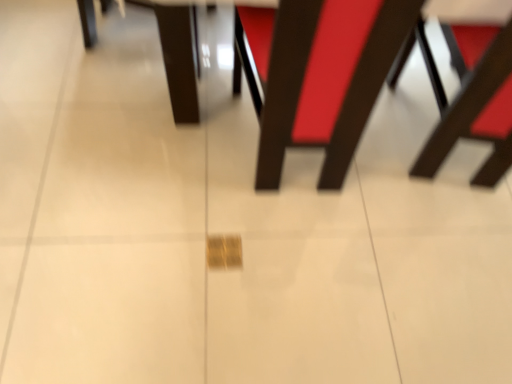
Describe the element at coordinates (319, 75) in the screenshot. This screenshot has height=384, width=512. I see `matte brown chair at center, the 1th chair in the left-to-right sequence` at that location.

What is the approximate width of matte brown chair at center, the 2th chair viewed from the right?

matte brown chair at center, the 2th chair viewed from the right, is 18.12 inches in width.

The image size is (512, 384). I want to click on matte brown chair at center, the 2th chair viewed from the right, so click(x=319, y=75).

The width and height of the screenshot is (512, 384). Describe the element at coordinates (477, 106) in the screenshot. I see `wooden chair at right, marked as the second chair in a left-to-right arrangement` at that location.

The image size is (512, 384). Identify the location of wooden chair at right, the 1th chair viewed from the right. (477, 106).

The width and height of the screenshot is (512, 384). In order to click on matte brown chair at center, the 2th chair viewed from the right in this screenshot , I will do `click(319, 75)`.

Considering the relative positions of matte brown chair at center, the 1th chair in the left-to-right sequence, and wooden chair at right, the 1th chair viewed from the right, in the image provided, is matte brown chair at center, the 1th chair in the left-to-right sequence, to the left or to the right of wooden chair at right, the 1th chair viewed from the right,?

Clearly, matte brown chair at center, the 1th chair in the left-to-right sequence, is on the left of wooden chair at right, the 1th chair viewed from the right, in the image.

In the image, is matte brown chair at center, the 2th chair viewed from the right, positioned in front of or behind wooden chair at right, marked as the second chair in a left-to-right arrangement?

Visually, matte brown chair at center, the 2th chair viewed from the right, is located in front of wooden chair at right, marked as the second chair in a left-to-right arrangement.

Does point (376, 94) come closer to viewer compared to point (490, 61)?

No, it is not.

From the image's perspective, which is below, matte brown chair at center, the 1th chair in the left-to-right sequence, or wooden chair at right, marked as the second chair in a left-to-right arrangement?

From the image's view, matte brown chair at center, the 1th chair in the left-to-right sequence, is below.

From a real-world perspective, is matte brown chair at center, the 2th chair viewed from the right, over wooden chair at right, the 1th chair viewed from the right?

Yes.

Between matte brown chair at center, the 2th chair viewed from the right, and wooden chair at right, the 1th chair viewed from the right, which one has larger width?

matte brown chair at center, the 2th chair viewed from the right.

Looking at this image, considering the sizes of objects matte brown chair at center, the 1th chair in the left-to-right sequence, and wooden chair at right, marked as the second chair in a left-to-right arrangement, in the image provided, who is taller, matte brown chair at center, the 1th chair in the left-to-right sequence, or wooden chair at right, marked as the second chair in a left-to-right arrangement,?

With more height is matte brown chair at center, the 1th chair in the left-to-right sequence.

Between matte brown chair at center, the 2th chair viewed from the right, and wooden chair at right, the 1th chair viewed from the right, which one has larger size?

With larger size is matte brown chair at center, the 2th chair viewed from the right.

Is matte brown chair at center, the 1th chair in the left-to-right sequence, located outside wooden chair at right, the 1th chair viewed from the right?

Yes, matte brown chair at center, the 1th chair in the left-to-right sequence, is located beyond the bounds of wooden chair at right, the 1th chair viewed from the right.

Is matte brown chair at center, the 2th chair viewed from the right, with wooden chair at right, the 1th chair viewed from the right?

No.

Is matte brown chair at center, the 2th chair viewed from the right, aimed at wooden chair at right, marked as the second chair in a left-to-right arrangement?

No, matte brown chair at center, the 2th chair viewed from the right, is not oriented towards wooden chair at right, marked as the second chair in a left-to-right arrangement.

What's the angular difference between matte brown chair at center, the 2th chair viewed from the right, and wooden chair at right, the 1th chair viewed from the right,'s facing directions?

They differ by 11.2 degrees in their facing directions.

Locate an element on the screen. The height and width of the screenshot is (384, 512). chair below the matte brown chair at center, the 1th chair in the left-to-right sequence (from a real-world perspective) is located at coordinates (477, 106).

Does wooden chair at right, marked as the second chair in a left-to-right arrangement, appear on the right side of matte brown chair at center, the 2th chair viewed from the right?

Indeed, wooden chair at right, marked as the second chair in a left-to-right arrangement, is positioned on the right side of matte brown chair at center, the 2th chair viewed from the right.

In the image, is wooden chair at right, the 1th chair viewed from the right, positioned in front of or behind matte brown chair at center, the 2th chair viewed from the right?

Clearly, wooden chair at right, the 1th chair viewed from the right, is behind matte brown chair at center, the 2th chair viewed from the right.

Does point (502, 73) lie in front of point (330, 126)?

Yes, it is.

From the image's perspective, is wooden chair at right, marked as the second chair in a left-to-right arrangement, located above or below matte brown chair at center, the 2th chair viewed from the right?

Clearly, from the image's perspective, wooden chair at right, marked as the second chair in a left-to-right arrangement, is above matte brown chair at center, the 2th chair viewed from the right.

From a real-world perspective, who is located higher, wooden chair at right, the 1th chair viewed from the right, or matte brown chair at center, the 1th chair in the left-to-right sequence?

From a 3D spatial view, matte brown chair at center, the 1th chair in the left-to-right sequence, is above.

Consider the image. Considering the sizes of objects wooden chair at right, marked as the second chair in a left-to-right arrangement, and matte brown chair at center, the 2th chair viewed from the right, in the image provided, who is wider, wooden chair at right, marked as the second chair in a left-to-right arrangement, or matte brown chair at center, the 2th chair viewed from the right,?

matte brown chair at center, the 2th chair viewed from the right.

Considering the sizes of objects wooden chair at right, marked as the second chair in a left-to-right arrangement, and matte brown chair at center, the 2th chair viewed from the right, in the image provided, who is shorter, wooden chair at right, marked as the second chair in a left-to-right arrangement, or matte brown chair at center, the 2th chair viewed from the right,?

wooden chair at right, marked as the second chair in a left-to-right arrangement, is shorter.

From the picture: Based on their sizes in the image, would you say wooden chair at right, the 1th chair viewed from the right, is bigger or smaller than matte brown chair at center, the 2th chair viewed from the right?

wooden chair at right, the 1th chair viewed from the right, is smaller than matte brown chair at center, the 2th chair viewed from the right.

Would you say matte brown chair at center, the 2th chair viewed from the right, is part of wooden chair at right, the 1th chair viewed from the right,'s contents?

That's incorrect, matte brown chair at center, the 2th chair viewed from the right, is not inside wooden chair at right, the 1th chair viewed from the right.

Is wooden chair at right, the 1th chair viewed from the right, beside matte brown chair at center, the 2th chair viewed from the right?

No, wooden chair at right, the 1th chair viewed from the right, is not making contact with matte brown chair at center, the 2th chair viewed from the right.

Could you tell me if wooden chair at right, the 1th chair viewed from the right, is facing matte brown chair at center, the 1th chair in the left-to-right sequence?

No, wooden chair at right, the 1th chair viewed from the right, is not facing towards matte brown chair at center, the 1th chair in the left-to-right sequence.

The width and height of the screenshot is (512, 384). In order to click on chair beneath the matte brown chair at center, the 2th chair viewed from the right (from a real-world perspective) in this screenshot , I will do `click(477, 106)`.

This screenshot has width=512, height=384. What are the coordinates of `chair in front of the wooden chair at right, the 1th chair viewed from the right` in the screenshot? It's located at (319, 75).

In the image, there is a wooden chair at right, marked as the second chair in a left-to-right arrangement. Identify the location of chair below it (from the image's perspective). (319, 75).